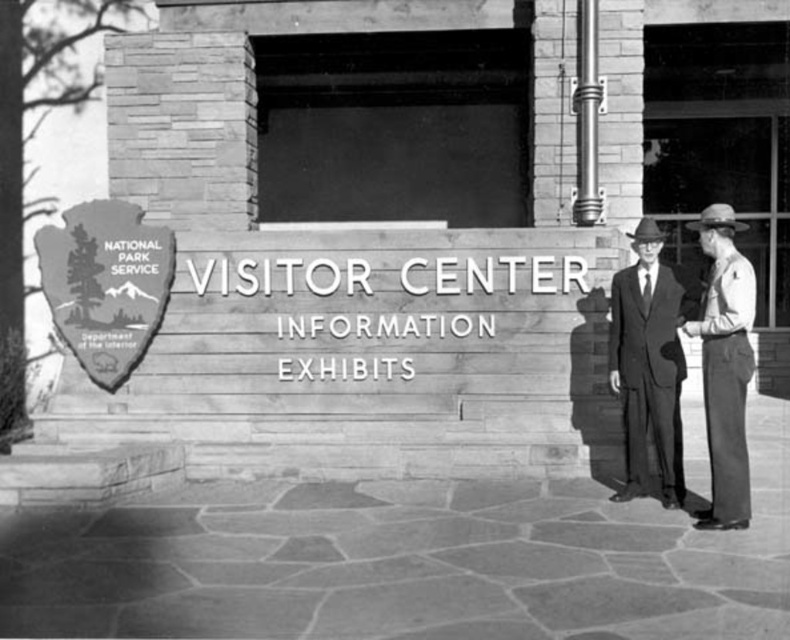
Question: Is wooden shield at center wider than smooth leather hat at right?

Choices:
 (A) no
 (B) yes

Answer: (B)

Question: Which of the following is the farthest from the observer?

Choices:
 (A) (747, 314)
 (B) (72, 243)

Answer: (B)

Question: Can you confirm if wooden shield at center is bigger than smooth leather hat at right?

Choices:
 (A) yes
 (B) no

Answer: (B)

Question: Is wooden shield at center to the right of smooth leather hat at right from the viewer's perspective?

Choices:
 (A) no
 (B) yes

Answer: (A)

Question: Among these objects, which one is farthest from the camera?

Choices:
 (A) wooden shield at center
 (B) smooth leather hat at right

Answer: (A)

Question: Among these objects, which one is farthest from the camera?

Choices:
 (A) smooth leather hat at right
 (B) wooden shield at center

Answer: (B)